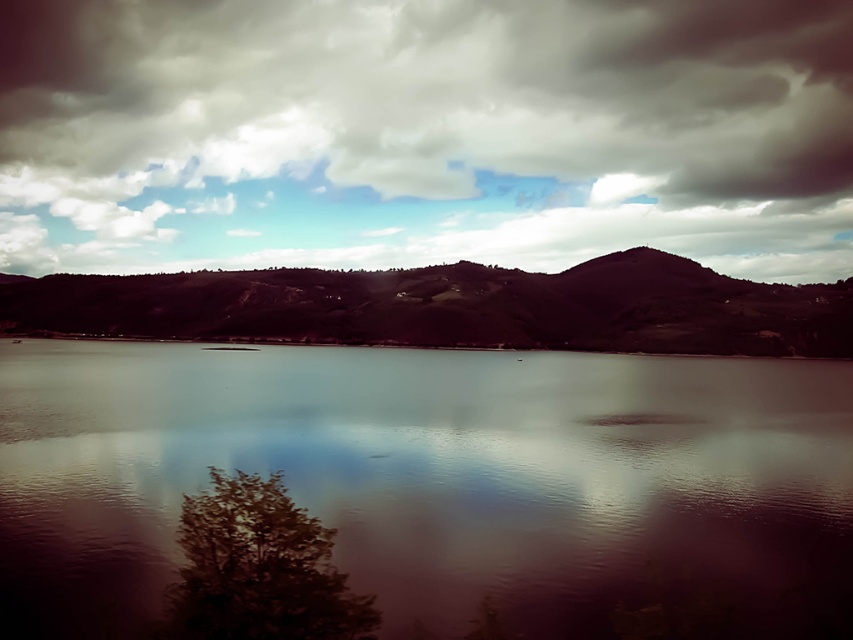
You are standing at the edge of the scene and want to walk towards the smooth water at center. Which direction should you go relative to the dark brown textured hill at center?

To reach the smooth water at center, you should walk downward towards it since it is located below the dark brown textured hill at center.

You are an artist planning to paint the scene. You need to position the cloudy sky at upper center and the dark brown textured hill at center in your painting. According to the image, which object is located to the right side of the other?

The cloudy sky at upper center is located to the right of the dark brown textured hill at center.